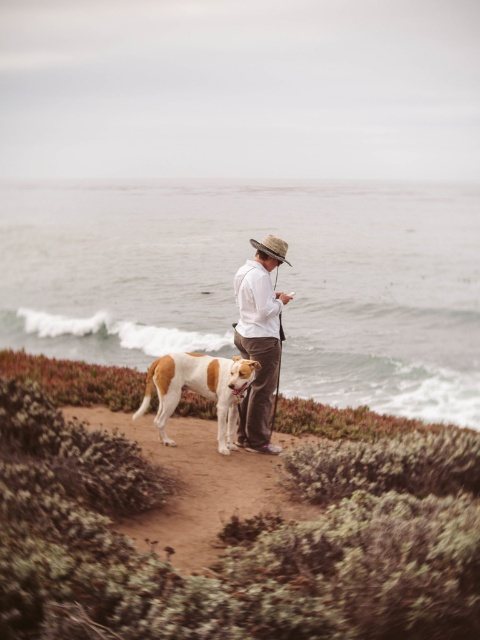
You are planning to place a small bench on the brown dirt path at center. According to the coordinates provided, where should you position the bench to ensure it is centered on the path?

The bench should be positioned at the coordinates point [195,484] to ensure it is centered on the brown dirt path at center.

In the scene shown: You are planning to walk your dog along the brown dirt path at center with your white and brown fur dog at center. Considering their sizes, will the path be wide enough for both of you to walk side by side comfortably?

The brown dirt path at center has a larger size compared to the white and brown fur dog at center, so yes, the path is wide enough for both to walk side by side comfortably.